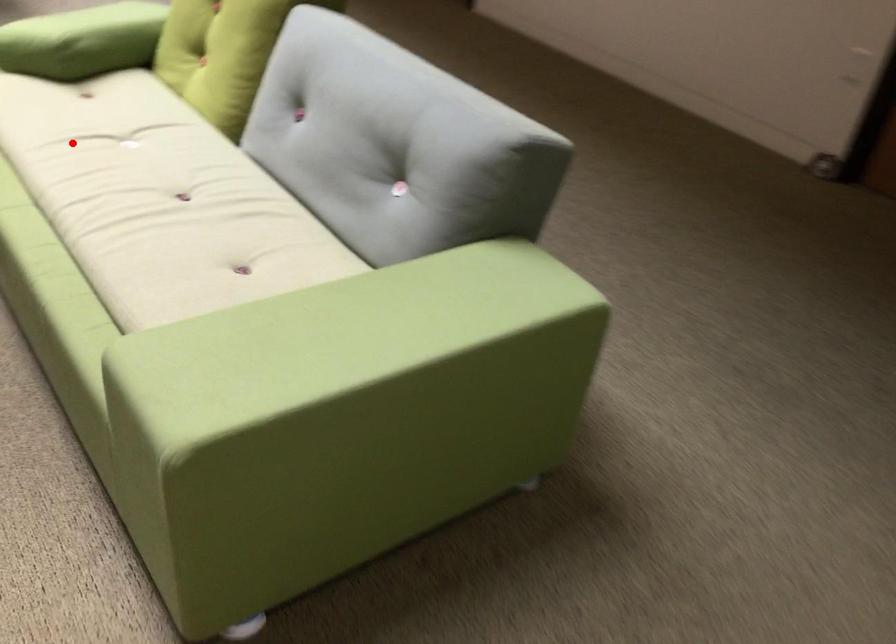
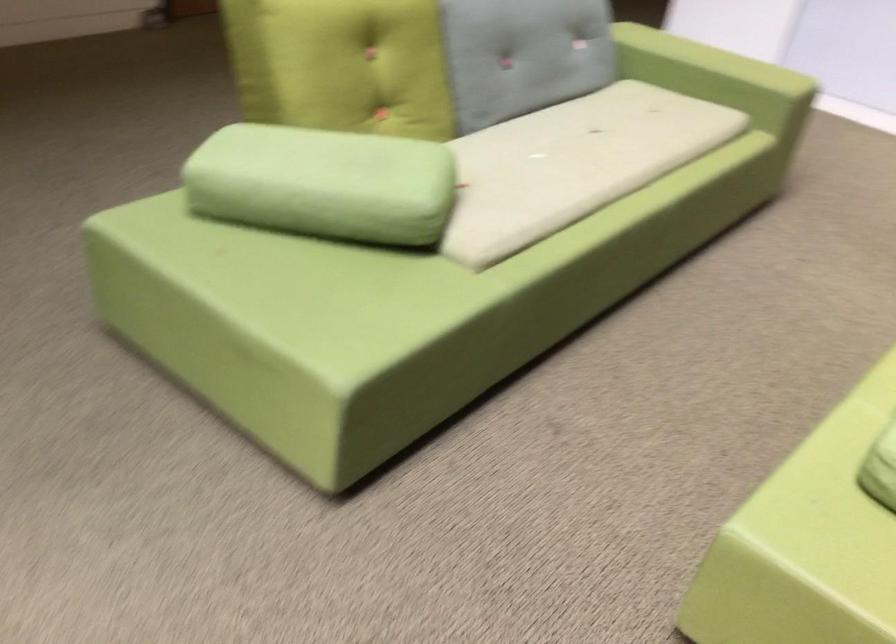
Question: I am providing you with two images of the same scene from different viewpoints. In image1, a red point is highlighted. Considering the same 3D point in image2, which of the following is correct?

Choices:
 (A) It is closer
 (B) It is farther

Answer: (B)